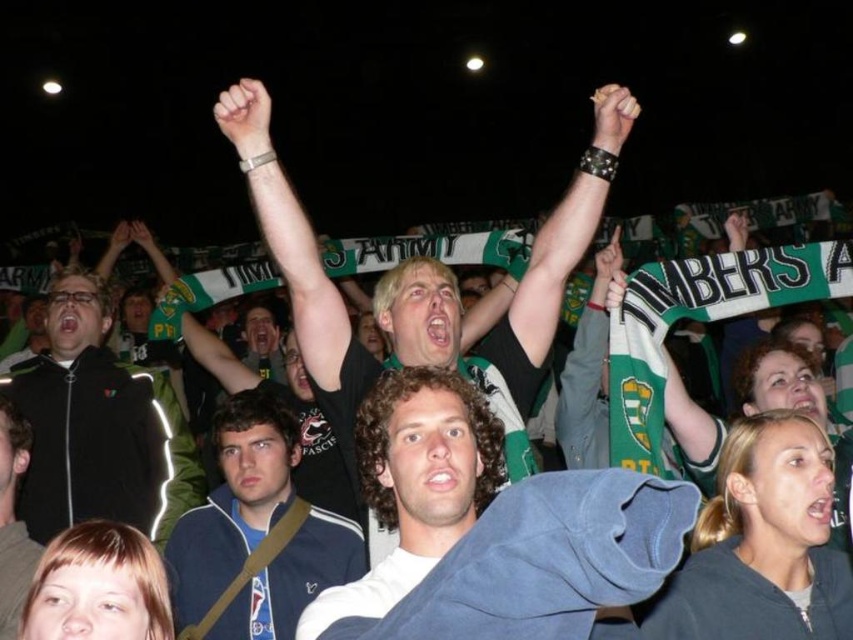
Between point (421, 576) and point (28, 572), which one is positioned behind?

The point (28, 572) is behind.

Looking at this image, is curly-haired man at center wider than dark blue jacket at lower left?

Correct, the width of curly-haired man at center exceeds that of dark blue jacket at lower left.

Between point (425, 449) and point (3, 520), which one is positioned in front?

Point (425, 449)

Image resolution: width=853 pixels, height=640 pixels. In order to click on curly-haired man at center in this screenshot , I will do `click(491, 528)`.

Does black matte jacket at left lie in front of blue fabric jacket at center?

No, black matte jacket at left is behind blue fabric jacket at center.

Image resolution: width=853 pixels, height=640 pixels. Find the location of `black matte jacket at left`. black matte jacket at left is located at coordinates (99, 426).

The width and height of the screenshot is (853, 640). What do you see at coordinates (99, 426) in the screenshot? I see `black matte jacket at left` at bounding box center [99, 426].

I want to click on black matte jacket at left, so click(x=99, y=426).

Is curly-haired man at center wider than blue fabric jacket at center?

In fact, curly-haired man at center might be narrower than blue fabric jacket at center.

Which is more to the right, curly-haired man at center or blue fabric jacket at center?

curly-haired man at center

Which is in front, point (670, 531) or point (236, 435)?

Positioned in front is point (670, 531).

Image resolution: width=853 pixels, height=640 pixels. What are the coordinates of `curly-haired man at center` in the screenshot? It's located at pyautogui.click(x=491, y=528).